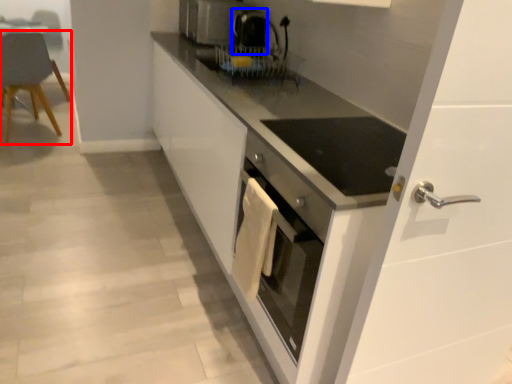
Question: Which point is further to the camera, chair (highlighted by a red box) or coffee machine (highlighted by a blue box)?

Choices:
 (A) chair
 (B) coffee machine

Answer: (A)